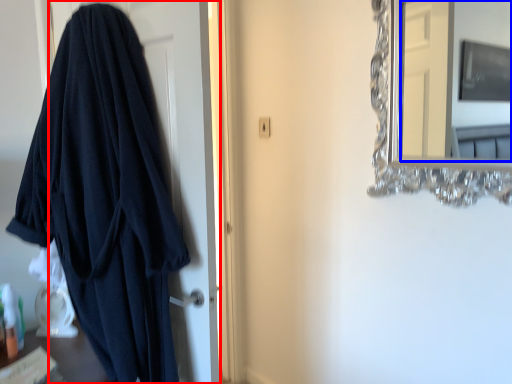
Question: Which object appears closest to the camera in this image, door (highlighted by a red box) or mirror (highlighted by a blue box)?

Choices:
 (A) door
 (B) mirror

Answer: (B)